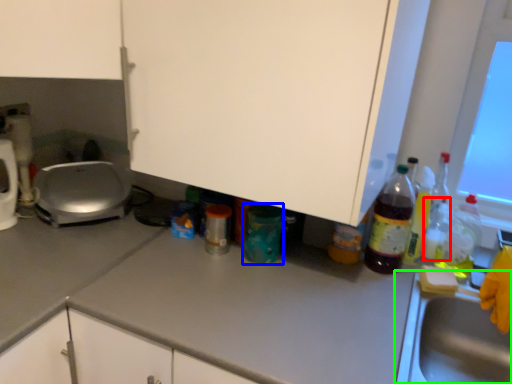
Question: Which object is the closest to the bottle (highlighted by a red box)? Choose among these: bottle (highlighted by a blue box) or sink (highlighted by a green box).

Choices:
 (A) bottle
 (B) sink

Answer: (B)